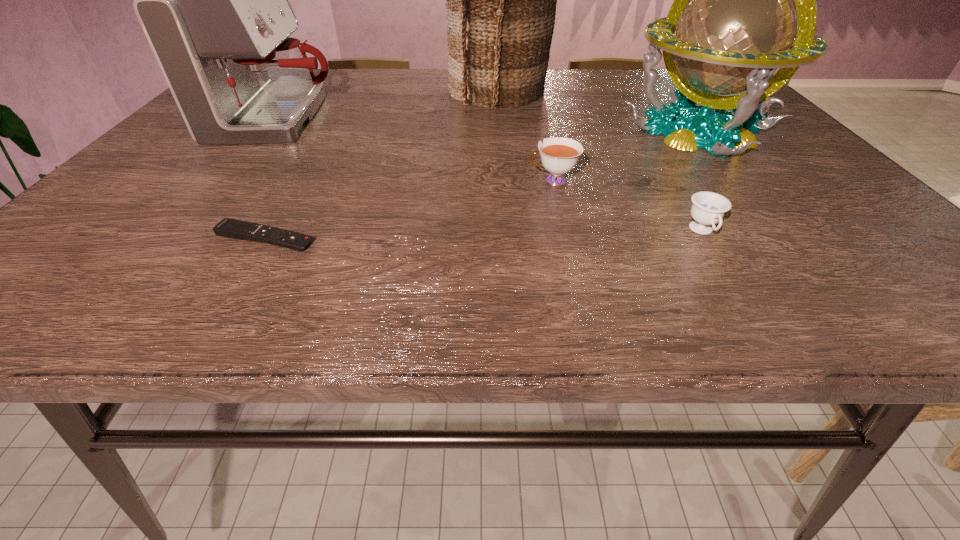
The image size is (960, 540). I want to click on free space located 0.180m on the front of the fourth shortest object near the spout, so click(x=407, y=119).

The height and width of the screenshot is (540, 960). Find the location of `vacant space located on the side of the farther teacup with the handle`. vacant space located on the side of the farther teacup with the handle is located at coordinates (339, 181).

The image size is (960, 540). Identify the location of vacant area located on the side of the farther teacup with the handle. (456, 181).

Where is `vacant space situated on the side of the farther teacup with the handle`? vacant space situated on the side of the farther teacup with the handle is located at coordinates (431, 181).

What are the coordinates of `free region located 0.150m on the side of the nearer teacup with the handle` in the screenshot? It's located at click(751, 312).

Find the location of a particular element. free point located on the back of the shortest object is located at coordinates (324, 138).

The image size is (960, 540). I want to click on basket at the far edge, so click(501, 0).

The height and width of the screenshot is (540, 960). I want to click on coffee maker that is at the far edge, so click(212, 0).

What are the coordinates of `object present at the left edge` in the screenshot? It's located at (212, 0).

Identify the location of object that is at the right edge. (741, 24).